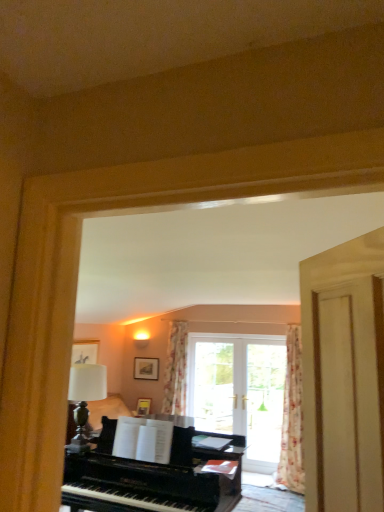
Question: From a real-world perspective, is matte black picture frame at center, placed as the first picture frame when sorted from back to front, physically above black polished piano at center?

Choices:
 (A) yes
 (B) no

Answer: (A)

Question: Is matte black picture frame at center, acting as the second picture frame starting from the bottom, oriented towards black polished piano at center?

Choices:
 (A) yes
 (B) no

Answer: (B)

Question: Is matte black picture frame at center, positioned as the 2th picture frame in front-to-back order, not near black polished piano at center?

Choices:
 (A) yes
 (B) no

Answer: (A)

Question: From the image's perspective, does matte black picture frame at center, positioned as the 2th picture frame in front-to-back order, appear higher than black polished piano at center?

Choices:
 (A) no
 (B) yes

Answer: (B)

Question: Is matte black picture frame at center, the first picture frame positioned from the top, located outside black polished piano at center?

Choices:
 (A) yes
 (B) no

Answer: (A)

Question: Is matte black picture frame at center, acting as the second picture frame starting from the bottom, further to the viewer compared to black polished piano at center?

Choices:
 (A) no
 (B) yes

Answer: (B)

Question: Is matte black picture frame at center, placed as the first picture frame when sorted from back to front, to the right of transparent glass door at center from the viewer's perspective?

Choices:
 (A) no
 (B) yes

Answer: (A)

Question: Does matte black picture frame at center, acting as the second picture frame starting from the bottom, have a larger size compared to transparent glass door at center?

Choices:
 (A) no
 (B) yes

Answer: (A)

Question: Would you say matte black picture frame at center, the first picture frame positioned from the top, contains transparent glass door at center?

Choices:
 (A) yes
 (B) no

Answer: (B)

Question: From a real-world perspective, does matte black picture frame at center, positioned as the 2th picture frame in front-to-back order, stand above transparent glass door at center?

Choices:
 (A) no
 (B) yes

Answer: (B)

Question: From the image's perspective, does matte black picture frame at center, the first picture frame positioned from the top, appear lower than transparent glass door at center?

Choices:
 (A) no
 (B) yes

Answer: (A)

Question: Can you confirm if matte black picture frame at center, placed as the first picture frame when sorted from back to front, is wider than transparent glass door at center?

Choices:
 (A) no
 (B) yes

Answer: (A)

Question: Can you confirm if floral fabric curtain at center, the second curtain positioned from the front, is positioned to the left of matte black picture frame at center, acting as the second picture frame starting from the bottom?

Choices:
 (A) yes
 (B) no

Answer: (B)